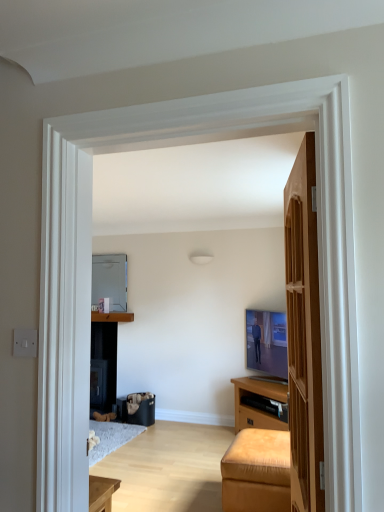
Question: From a real-world perspective, is matte brown cabinet at center located higher than wooden door at right?

Choices:
 (A) no
 (B) yes

Answer: (A)

Question: From the image's perspective, is matte brown cabinet at center under wooden door at right?

Choices:
 (A) yes
 (B) no

Answer: (A)

Question: Is matte brown cabinet at center placed right next to wooden door at right?

Choices:
 (A) yes
 (B) no

Answer: (B)

Question: Is matte brown cabinet at center not near wooden door at right?

Choices:
 (A) yes
 (B) no

Answer: (A)

Question: Considering the relative positions of matte brown cabinet at center and wooden door at right in the image provided, is matte brown cabinet at center to the right of wooden door at right from the viewer's perspective?

Choices:
 (A) yes
 (B) no

Answer: (B)

Question: Is wooden door at right at the back of matte brown cabinet at center?

Choices:
 (A) yes
 (B) no

Answer: (B)

Question: Considering the relative sizes of metallic refrigerator at center and matte brown cabinet at center in the image provided, is metallic refrigerator at center taller than matte brown cabinet at center?

Choices:
 (A) yes
 (B) no

Answer: (A)

Question: Is metallic refrigerator at center to the right of matte brown cabinet at center from the viewer's perspective?

Choices:
 (A) yes
 (B) no

Answer: (B)

Question: From the image's perspective, would you say metallic refrigerator at center is shown under matte brown cabinet at center?

Choices:
 (A) no
 (B) yes

Answer: (A)

Question: Can you confirm if metallic refrigerator at center is positioned to the left of matte brown cabinet at center?

Choices:
 (A) yes
 (B) no

Answer: (A)

Question: Can you confirm if metallic refrigerator at center is shorter than matte brown cabinet at center?

Choices:
 (A) no
 (B) yes

Answer: (A)

Question: Is matte brown cabinet at center at the back of metallic refrigerator at center?

Choices:
 (A) yes
 (B) no

Answer: (B)

Question: Does leather ottoman at lower right come in front of wooden door at right?

Choices:
 (A) yes
 (B) no

Answer: (B)